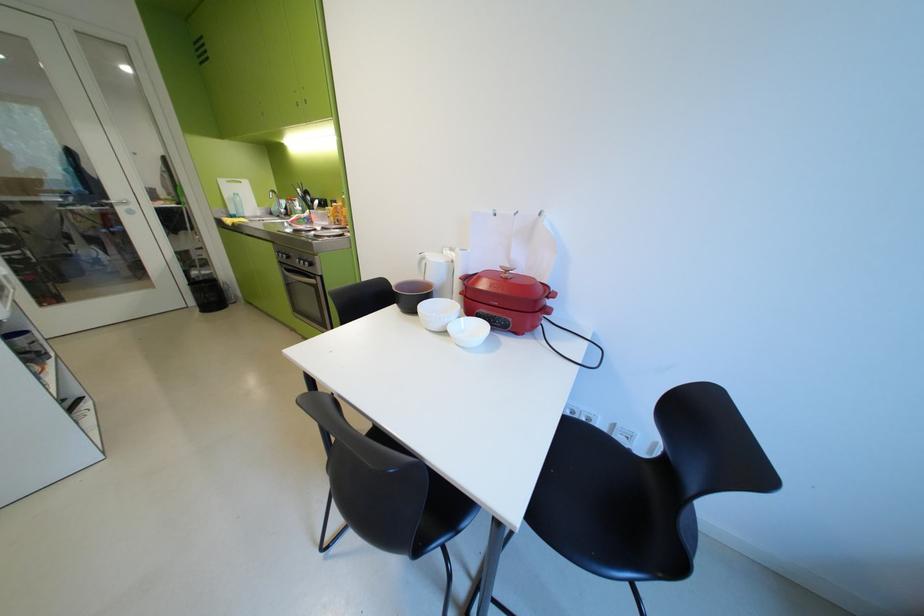
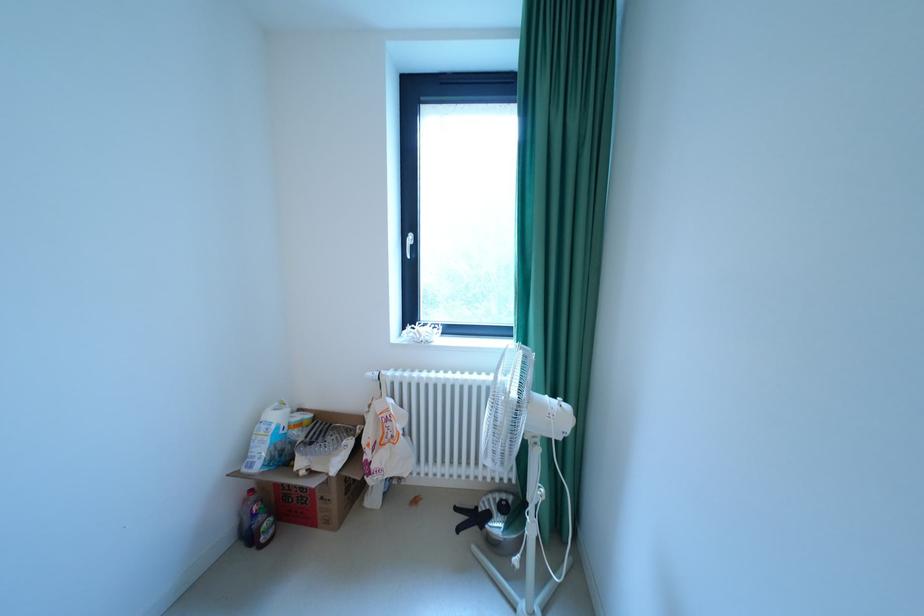
First-person continuous shooting, in which direction is the camera rotating?

The camera rotated toward right-down.